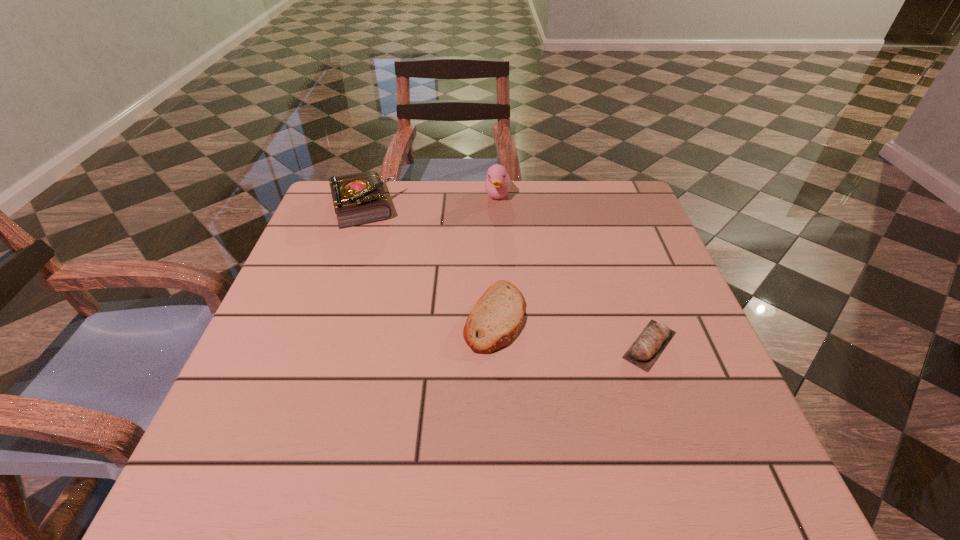
Find the location of `free space between the left pita bread and the right pita bread`. free space between the left pita bread and the right pita bread is located at coordinates (572, 331).

At what (x,y) coordinates should I click in order to perform the action: click on free spot between the diary and the right pita bread. Please return your answer as a coordinate pair (x, y). Looking at the image, I should click on (506, 275).

Locate an element on the screen. free space between the duckling and the left pita bread is located at coordinates (496, 255).

This screenshot has height=540, width=960. I want to click on vacant area between the rightmost object and the left pita bread, so click(x=572, y=331).

This screenshot has width=960, height=540. Find the location of `empty location between the rightmost object and the tallest object`. empty location between the rightmost object and the tallest object is located at coordinates (573, 270).

This screenshot has height=540, width=960. Find the location of `vacant region between the right pita bread and the left pita bread`. vacant region between the right pita bread and the left pita bread is located at coordinates (572, 331).

The width and height of the screenshot is (960, 540). I want to click on empty space that is in between the duckling and the leftmost object, so click(430, 200).

Where is `vacant area that lies between the diary and the tallest object`? vacant area that lies between the diary and the tallest object is located at coordinates (430, 200).

Image resolution: width=960 pixels, height=540 pixels. Find the location of `empty space between the left pita bread and the tallest object`. empty space between the left pita bread and the tallest object is located at coordinates (496, 255).

The width and height of the screenshot is (960, 540). In order to click on free space between the right pita bread and the tallest object in this screenshot , I will do `click(573, 270)`.